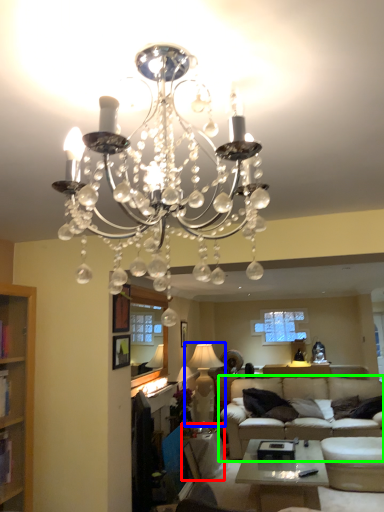
Question: Which is farther away from side table (highlighted by a red box)? lamp (highlighted by a blue box) or studio couch (highlighted by a green box)?

Choices:
 (A) lamp
 (B) studio couch

Answer: (A)